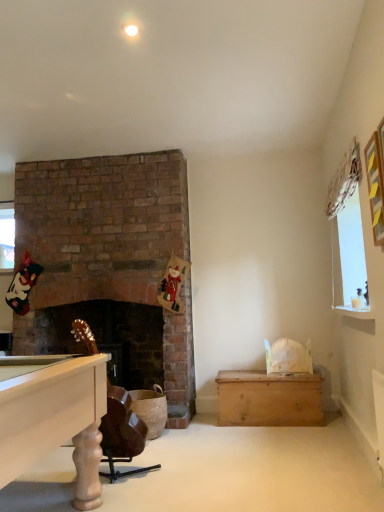
Question: In terms of height, does yellow paper picture frame at upper right look taller or shorter compared to wooden chest at lower right?

Choices:
 (A) tall
 (B) short

Answer: (A)

Question: Looking at the image, does yellow paper picture frame at upper right seem bigger or smaller compared to wooden chest at lower right?

Choices:
 (A) big
 (B) small

Answer: (B)

Question: Based on their relative distances, which object is nearer to the wooden chest at lower right?

Choices:
 (A) brown leather rocking chair at lower left
 (B) yellow paper picture frame at upper right

Answer: (A)

Question: Estimate the real-world distances between objects in this image. Which object is closer to the brown leather rocking chair at lower left?

Choices:
 (A) wooden chest at lower right
 (B) yellow paper picture frame at upper right

Answer: (A)